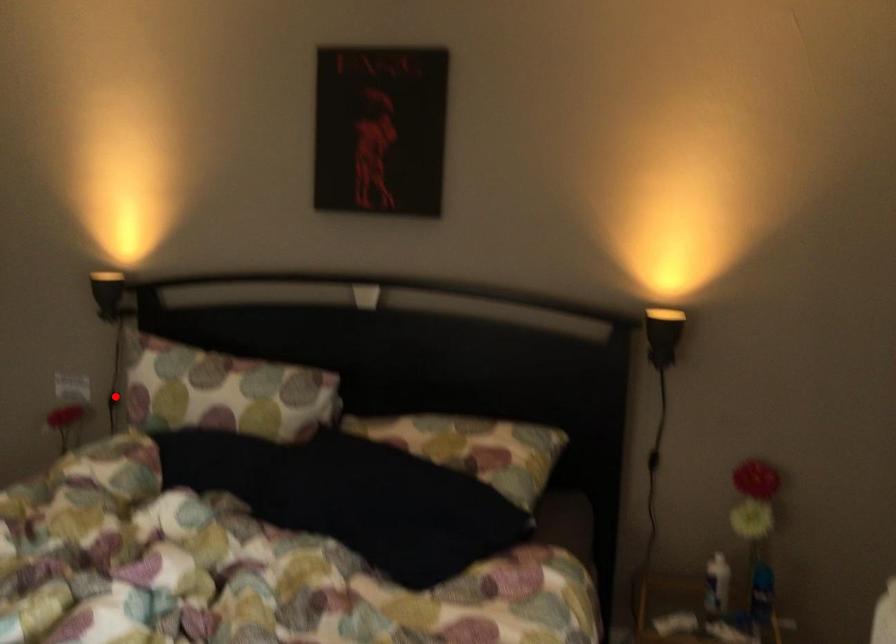
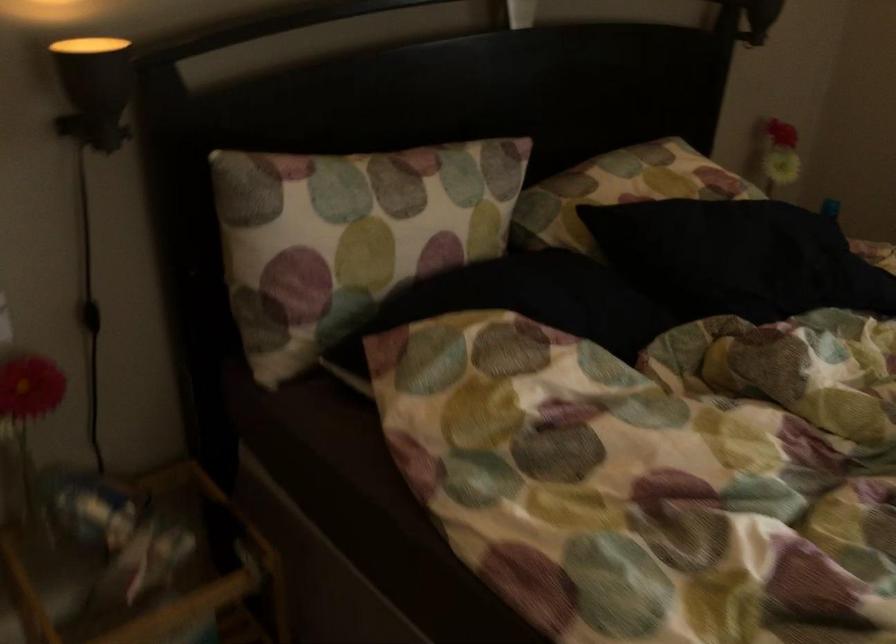
Find the pixel in the second image that matches the highlighted location in the first image.

(90, 316)